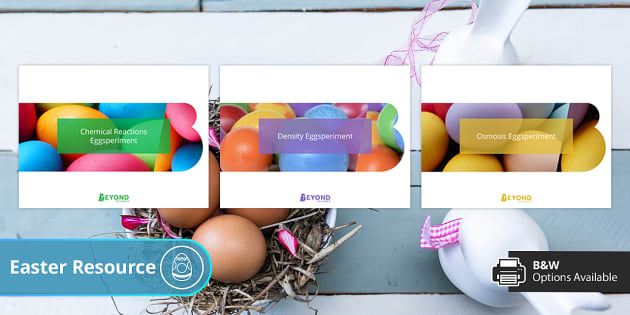
Identify the location of printer. This screenshot has width=630, height=315. (515, 271).